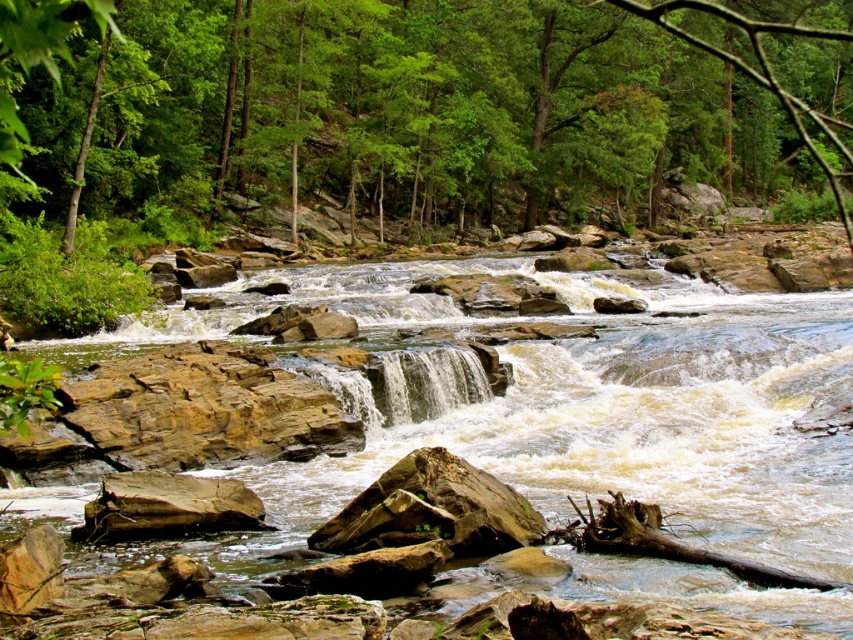
Question: Which point is closer to the camera?

Choices:
 (A) (252, 93)
 (B) (376, 321)

Answer: (B)

Question: Does green leafy tree at upper center come behind brown rocky stream at center?

Choices:
 (A) no
 (B) yes

Answer: (A)

Question: Does green leafy tree at upper center have a larger size compared to brown rocky stream at center?

Choices:
 (A) no
 (B) yes

Answer: (B)

Question: Which point appears farthest from the camera in this image?

Choices:
 (A) (288, 112)
 (B) (399, 369)

Answer: (A)

Question: Considering the relative positions of green leafy tree at upper center and brown rocky stream at center in the image provided, where is green leafy tree at upper center located with respect to brown rocky stream at center?

Choices:
 (A) left
 (B) right

Answer: (B)